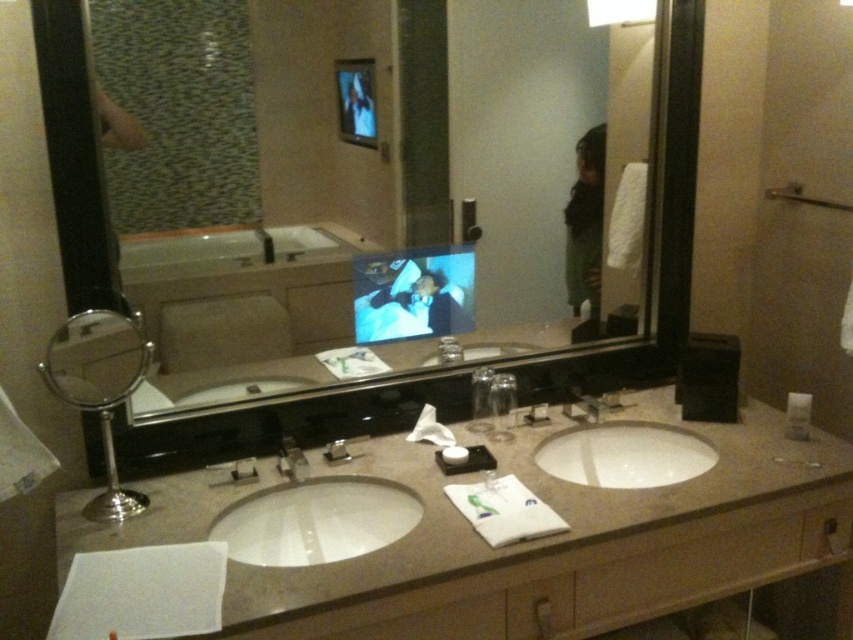
Question: Is clear glass mirror at center to the right of smooth beige countertop at center from the viewer's perspective?

Choices:
 (A) yes
 (B) no

Answer: (B)

Question: Considering the real-world distances, which object is farthest from the white glossy sink at center?

Choices:
 (A) brushed metal faucet at sink center
 (B) green matte dress at upper right

Answer: (B)

Question: Does white glossy sink at center have a larger size compared to brushed metal faucet at sink center?

Choices:
 (A) yes
 (B) no

Answer: (A)

Question: Among these objects, which one is farthest from the camera?

Choices:
 (A) smooth beige countertop at center
 (B) white ceramic sink at center

Answer: (B)

Question: Which object is positioned farthest from the green matte dress at upper right?

Choices:
 (A) brushed metal faucet at sink center
 (B) white plastic soap at right
 (C) white ceramic sink at center
 (D) smooth beige countertop at center

Answer: (D)

Question: Where is clear glass mirror at center located in relation to smooth beige countertop at center in the image?

Choices:
 (A) below
 (B) above

Answer: (B)